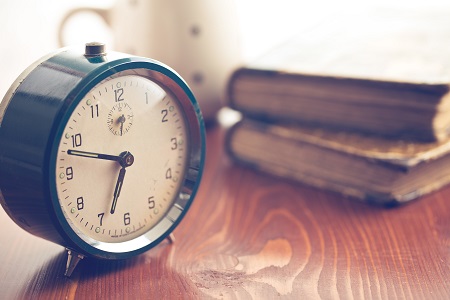
Image resolution: width=450 pixels, height=300 pixels. In order to click on mug in this screenshot , I will do coord(183,47).